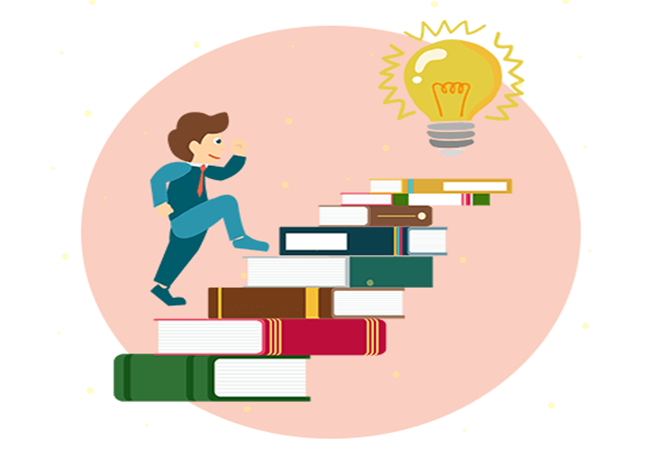
What are the coordinates of `book spines` in the screenshot? It's located at (172, 374), (296, 324), (294, 301), (398, 276), (348, 237), (413, 212), (437, 198), (456, 184).